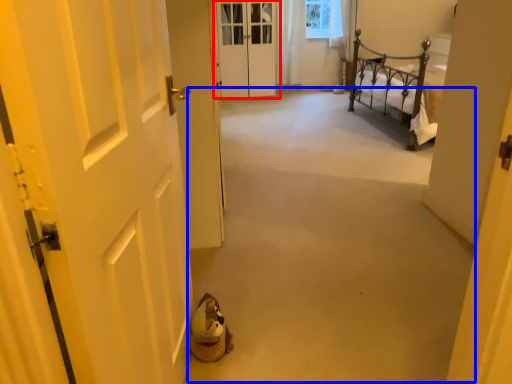
Question: Which point is further to the camera, door (highlighted by a red box) or corridor (highlighted by a blue box)?

Choices:
 (A) door
 (B) corridor

Answer: (A)